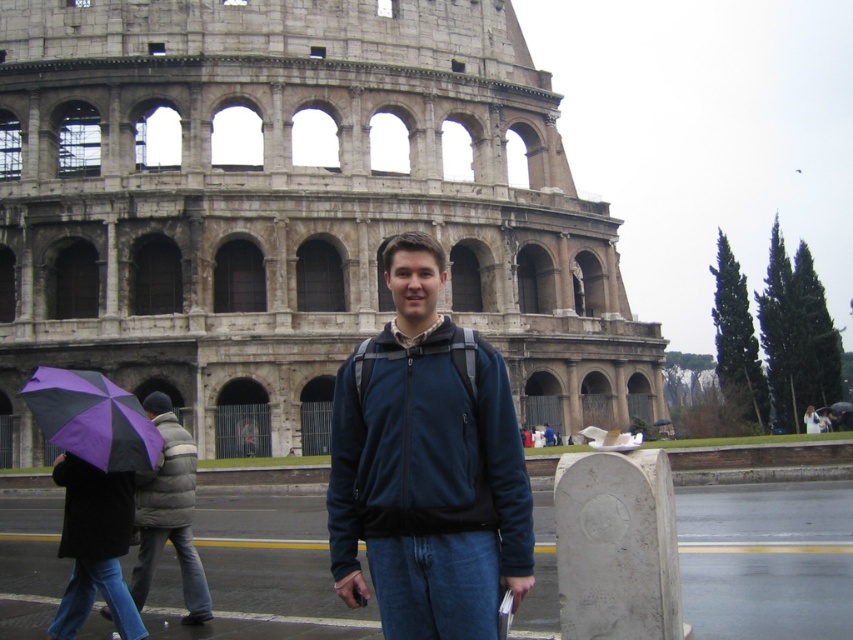
Is dark blue fleece jacket at center to the left of gray puffy jacket at left from the viewer's perspective?

Incorrect, dark blue fleece jacket at center is not on the left side of gray puffy jacket at left.

Is point (384, 260) closer to camera compared to point (144, 525)?

That is False.

Does point (392, 390) come farther from viewer compared to point (157, 461)?

No, it is in front of (157, 461).

Where is `dark blue fleece jacket at center`? dark blue fleece jacket at center is located at coordinates (427, 467).

Identify the location of stone amphitheater at center. This screenshot has height=640, width=853. (289, 211).

Is point (444, 113) less distant than point (471, 595)?

No, (444, 113) is further to viewer.

What are the coordinates of `stone amphitheater at center` in the screenshot? It's located at [289, 211].

Between purple fabric umbrella at left and dark gray fleece sweatshirt at lower left, which one is positioned higher?

purple fabric umbrella at left

Does purple fabric umbrella at left have a lesser height compared to dark gray fleece sweatshirt at lower left?

Indeed, purple fabric umbrella at left has a lesser height compared to dark gray fleece sweatshirt at lower left.

Identify the location of purple fabric umbrella at left. This screenshot has width=853, height=640. (91, 419).